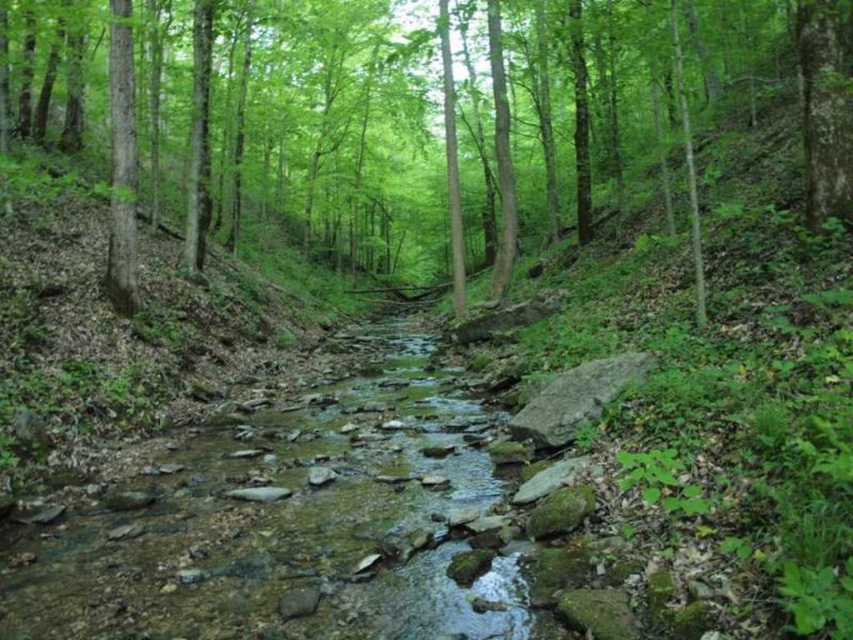
Question: Does green leafy tree at center appear over clear water at stream center?

Choices:
 (A) no
 (B) yes

Answer: (B)

Question: Which point appears farthest from the camera in this image?

Choices:
 (A) (410, 60)
 (B) (212, 632)

Answer: (A)

Question: From the image, what is the correct spatial relationship of green leafy tree at center in relation to clear water at stream center?

Choices:
 (A) right
 (B) left

Answer: (B)

Question: Can you confirm if green leafy tree at center is positioned to the right of clear water at stream center?

Choices:
 (A) yes
 (B) no

Answer: (B)

Question: Which point appears closest to the camera in this image?

Choices:
 (A) (589, 152)
 (B) (61, 586)

Answer: (B)